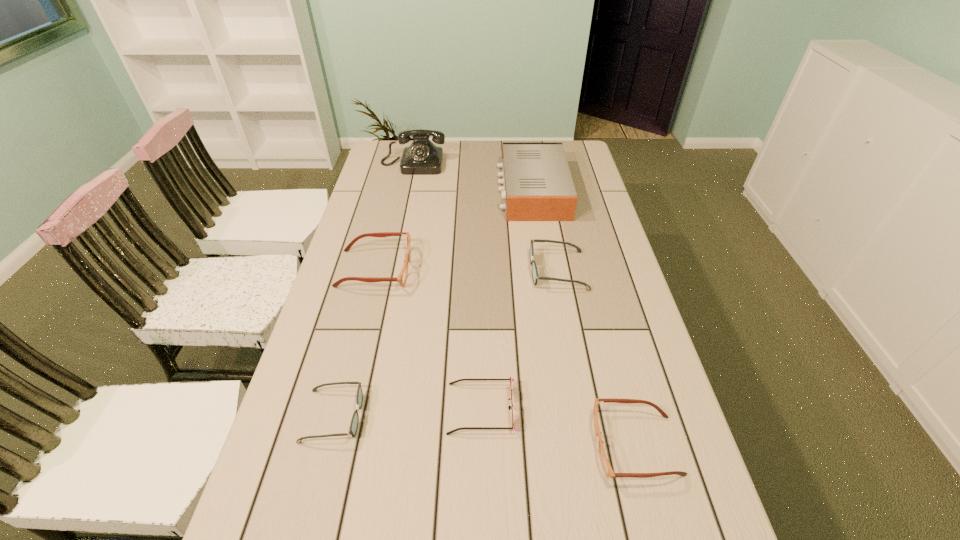
This screenshot has height=540, width=960. What are the coordinates of `radio receiver located in the right edge section of the desktop` in the screenshot? It's located at (537, 184).

Image resolution: width=960 pixels, height=540 pixels. In order to click on object that is positioned at the far left corner in this screenshot , I will do `click(422, 157)`.

Identify the location of object present at the far right corner. (537, 184).

This screenshot has height=540, width=960. In the image, there is a desktop. In order to click on vacant area at the far edge in this screenshot , I will do `click(476, 163)`.

Identify the location of vacant space at the left edge of the desktop. The image size is (960, 540). (361, 308).

In the image, there is a desktop. At what (x,y) coordinates should I click in order to perform the action: click on vacant space at the right edge. Please return your answer as a coordinate pair (x, y). The height and width of the screenshot is (540, 960). Looking at the image, I should click on (597, 316).

At what (x,y) coordinates should I click in order to perform the action: click on free space at the far right corner of the desktop. Please return your answer as a coordinate pair (x, y). The image size is (960, 540). Looking at the image, I should click on (546, 141).

Locate an element on the screen. The height and width of the screenshot is (540, 960). free spot between the left gray spectacles and the telephone is located at coordinates (373, 290).

You are a GUI agent. You are given a task and a screenshot of the screen. Output one action in this format:
    pyautogui.click(x=<x>, y=<y>)
    Task: Click on the free space between the black telephone and the sixth shortest object
    Image resolution: width=960 pixels, height=540 pixels.
    Given the screenshot: What is the action you would take?
    pyautogui.click(x=472, y=177)

At what (x,y) coordinates should I click in order to perform the action: click on free point between the telephone and the left gray spectacles. Please return your answer as a coordinate pair (x, y). Image resolution: width=960 pixels, height=540 pixels. Looking at the image, I should click on (373, 290).